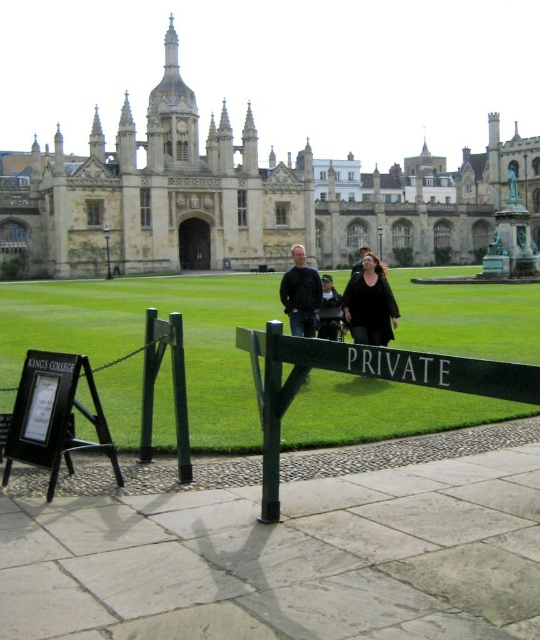
What is the height relationship between the black wood sign at lower left and the black matte jacket at center in the King College scene?

The black wood sign at lower left has a greater height compared to the black matte jacket at center.

You are a tourist visiting King College and want to take a photo of the iconic chapel. You notice the black wood sign at lower left and the black matte jacket at center. Which object should you move to ensure the other is fully visible in your photo?

You should move the black wood sign at lower left since it is in front of the black matte jacket at center, blocking its view. Removing the sign will allow the jacket to be fully visible.